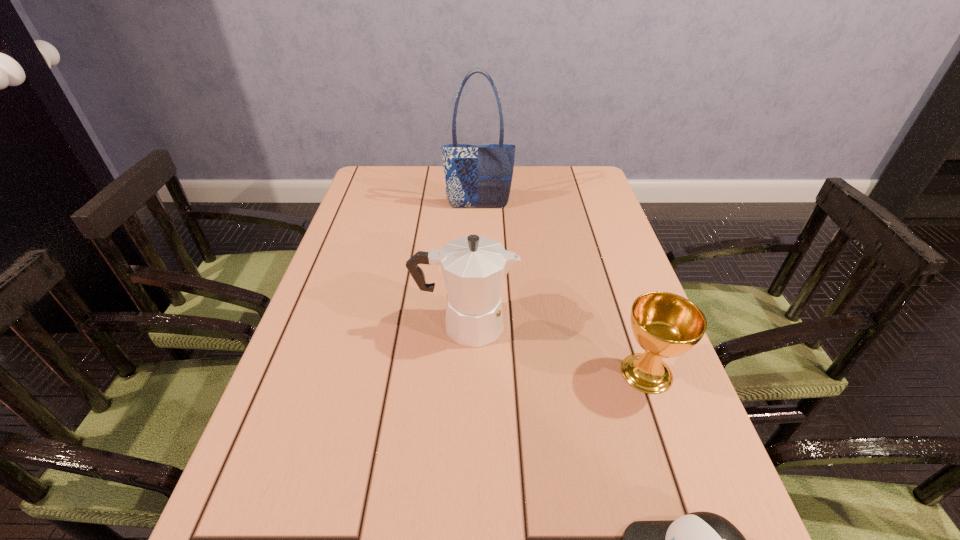
Where is `the farthest object`? the farthest object is located at coordinates (477, 176).

Locate an element on the screen. shopping bag is located at coordinates click(x=477, y=176).

Where is `coffeepot`? coffeepot is located at coordinates (474, 267).

At what (x,y) coordinates should I click in order to perform the action: click on the third shortest object. Please return your answer as a coordinate pair (x, y). The height and width of the screenshot is (540, 960). Looking at the image, I should click on (474, 267).

Locate an element on the screen. The width and height of the screenshot is (960, 540). chalice is located at coordinates (666, 325).

The image size is (960, 540). Identify the location of the second shortest object. (666, 325).

You are a GUI agent. You are given a task and a screenshot of the screen. Output one action in this format:
    pyautogui.click(x=<x>, y=<y>)
    Task: Click on the free space located on the front-facing side of the shopping bag
    This screenshot has height=540, width=960.
    Given the screenshot: What is the action you would take?
    pyautogui.click(x=478, y=299)

At what (x,y) coordinates should I click in order to perform the action: click on free region located 0.160m at the spout of the second farthest object. Please return your answer as a coordinate pair (x, y). This screenshot has height=540, width=960. Looking at the image, I should click on (587, 325).

This screenshot has width=960, height=540. I want to click on vacant space located on the back of the third tallest object, so click(x=624, y=309).

The width and height of the screenshot is (960, 540). In order to click on object at the right edge in this screenshot , I will do `click(666, 325)`.